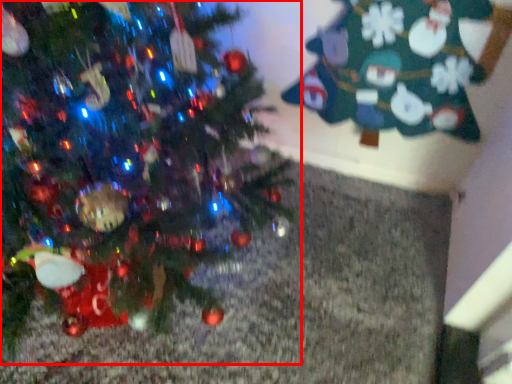
Question: Observing the image, what is the correct spatial positioning of christmas tree (annotated by the red box) in reference to christmas tree?

Choices:
 (A) left
 (B) right

Answer: (A)